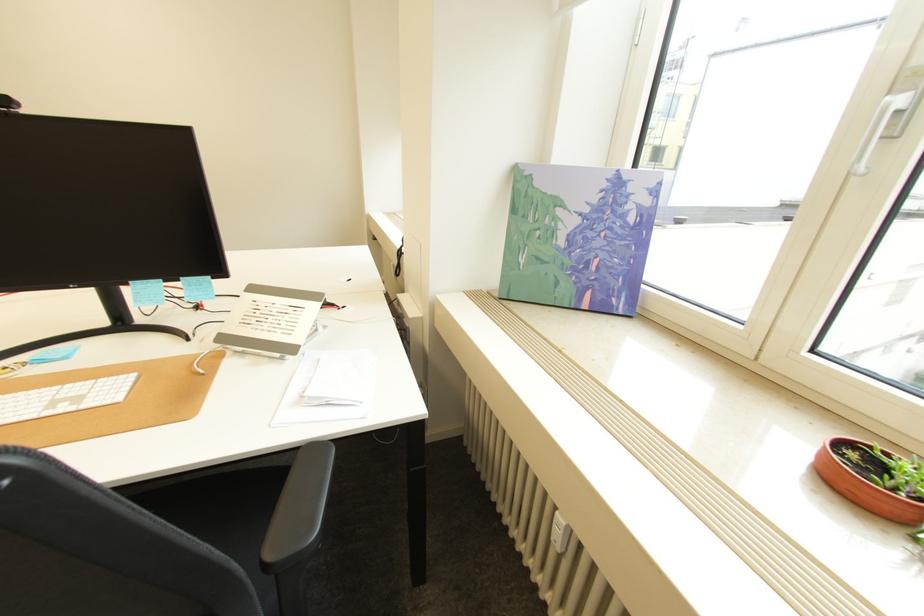
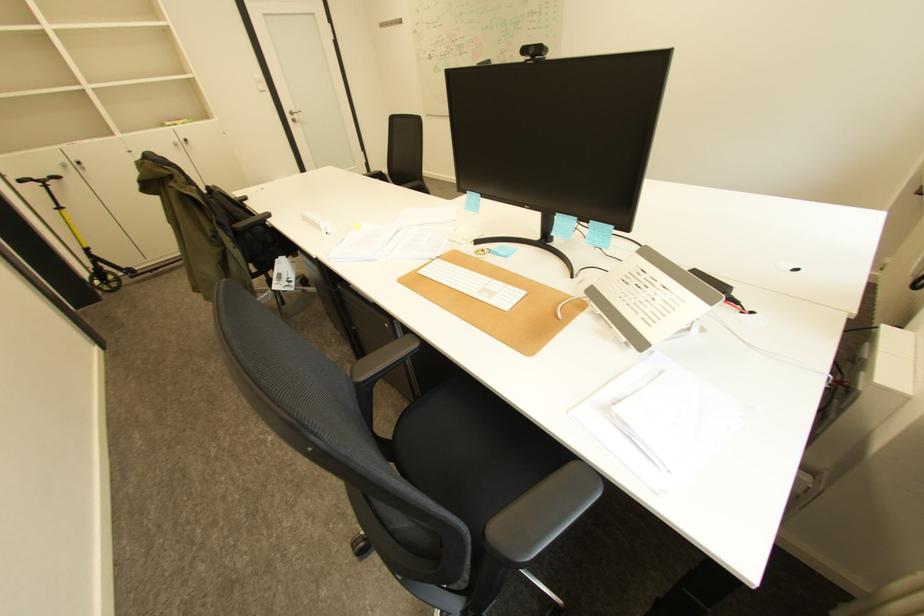
Based on the continuous images, in which direction is the camera rotating?

The rotation direction of the camera is left-down.